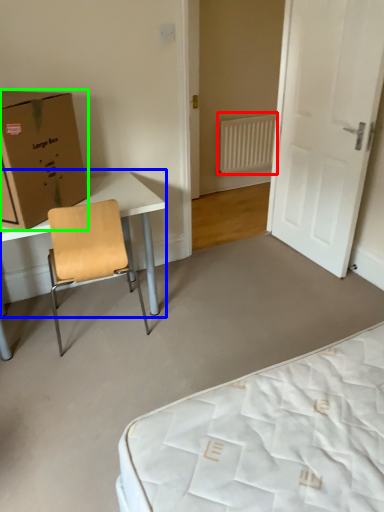
Question: Which object is the farthest from radiator (highlighted by a red box)? Choose among these: table (highlighted by a blue box) or box (highlighted by a green box).

Choices:
 (A) table
 (B) box

Answer: (B)